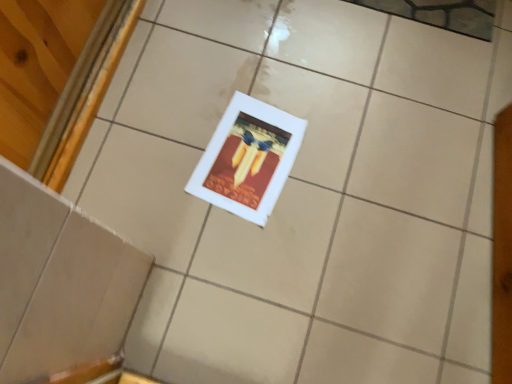
Locate an element on the screen. This screenshot has height=384, width=512. free space to the back side of white matte picture frame at center is located at coordinates (265, 70).